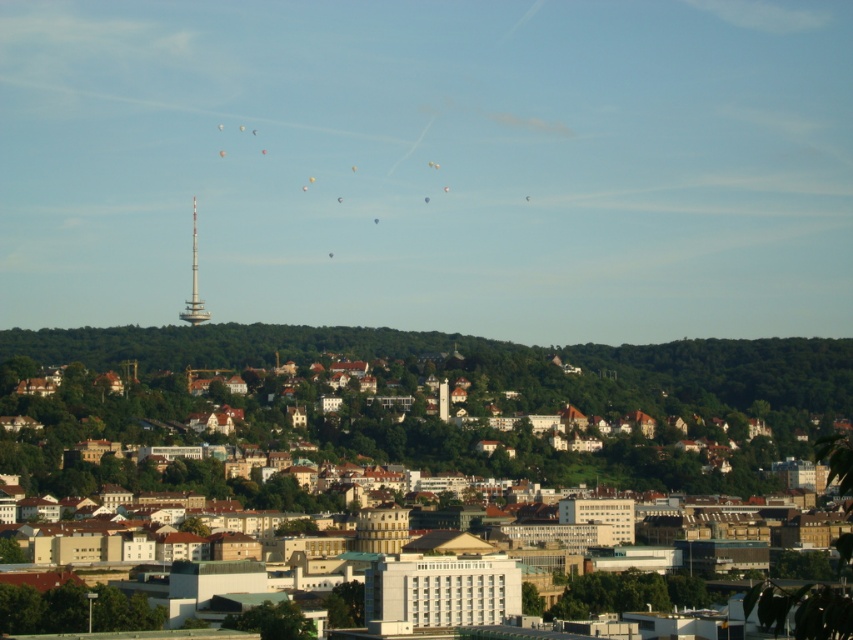
Can you confirm if white matte building at center is positioned above silver metallic tower at center?

No.

Is white matte building at center in front of silver metallic tower at center?

Yes, it is in front of silver metallic tower at center.

You are a GUI agent. You are given a task and a screenshot of the screen. Output one action in this format:
    pyautogui.click(x=<x>, y=<y>)
    Task: Click on the white matte building at center
    This screenshot has width=853, height=640.
    Given the screenshot: What is the action you would take?
    [x=437, y=417]